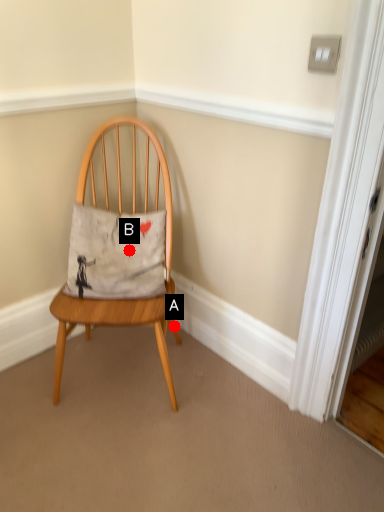
Question: Two points are circled on the image, labeled by A and B beside each circle. Which point is closer to the camera taking this photo?

Choices:
 (A) A is closer
 (B) B is closer

Answer: (B)